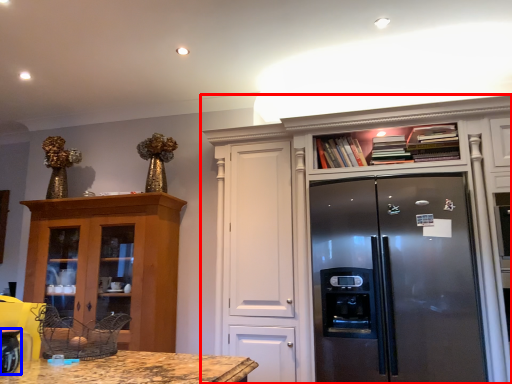
Question: Which object is closer to the camera taking this photo, cabinetry (highlighted by a red box) or appliance (highlighted by a blue box)?

Choices:
 (A) cabinetry
 (B) appliance

Answer: (B)